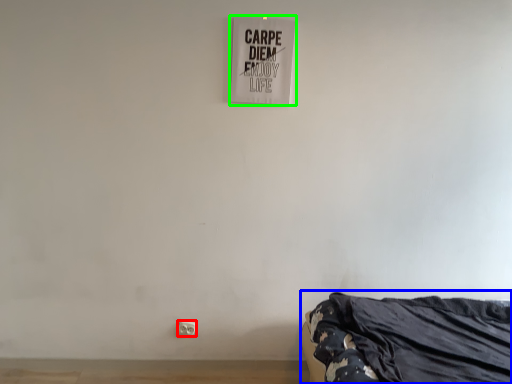
Question: Which object is positioned closest to electric outlet (highlighted by a red box)? Select from furniture (highlighted by a blue box) and signage (highlighted by a green box).

Choices:
 (A) furniture
 (B) signage

Answer: (A)